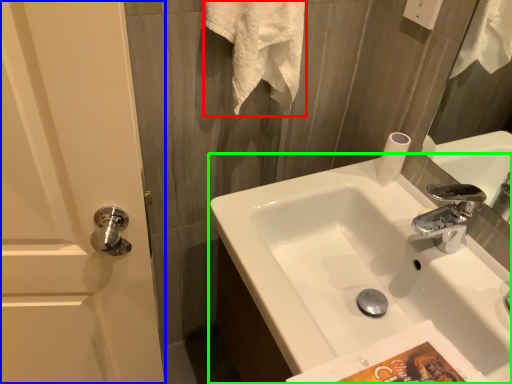
Question: Based on their relative distances, which object is nearer to bath towel (highlighted by a red box)? Choose from screen door (highlighted by a blue box) and sink (highlighted by a green box).

Choices:
 (A) screen door
 (B) sink

Answer: (B)